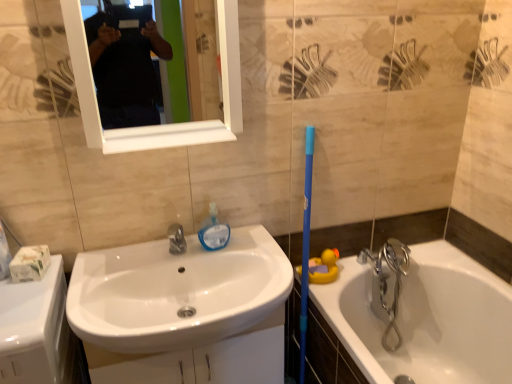
Identify the location of vacant region to the right of yellow rubber duck at lower right. This screenshot has width=512, height=384. (356, 272).